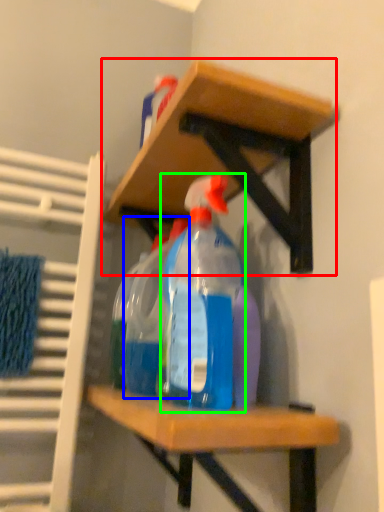
Question: Which object is the farthest from shelf (highlighted by a red box)? Choose among these: bottle (highlighted by a blue box) or bottle (highlighted by a green box).

Choices:
 (A) bottle
 (B) bottle

Answer: (A)